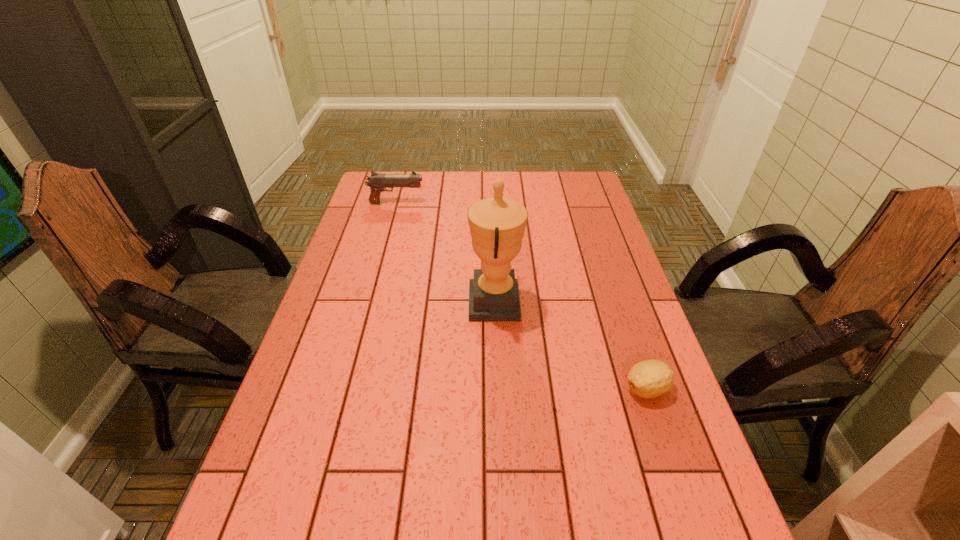
The height and width of the screenshot is (540, 960). In order to click on blank area located 0.370m at the stem end of the rightmost object in this screenshot , I will do `click(463, 389)`.

This screenshot has width=960, height=540. In order to click on vacant space located at the stem end of the rightmost object in this screenshot , I will do `click(588, 389)`.

Locate an element on the screen. The image size is (960, 540). free point located at the stem end of the rightmost object is located at coordinates (467, 389).

This screenshot has height=540, width=960. I want to click on object at the far edge, so click(x=377, y=182).

Identify the location of object at the left edge. (377, 182).

Find the location of `object that is at the right edge`. object that is at the right edge is located at coordinates (648, 379).

Locate an element on the screen. The image size is (960, 540). object positioned at the far left corner is located at coordinates (377, 182).

The image size is (960, 540). Find the location of `vacant space at the far edge of the desktop`. vacant space at the far edge of the desktop is located at coordinates (436, 200).

This screenshot has width=960, height=540. Identify the location of vacant space at the left edge of the desktop. (364, 208).

This screenshot has width=960, height=540. I want to click on vacant space at the right edge, so click(x=601, y=229).